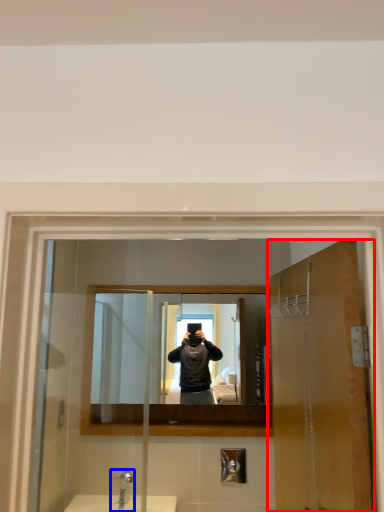
Question: Which of the following is the closest to the observer, door (highlighted by a red box) or tap (highlighted by a blue box)?

Choices:
 (A) door
 (B) tap

Answer: (A)